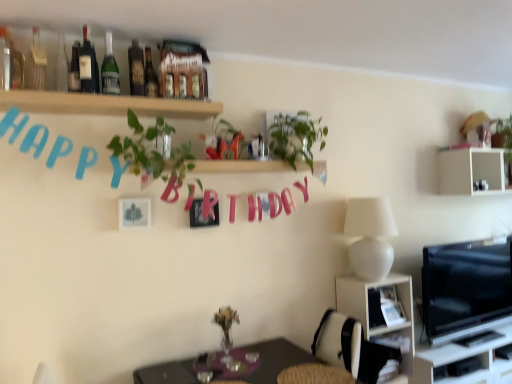
Question: Is matte black bottle at upper center, placed as the 7th bottle when sorted from left to right, situated inside green glass bottle at upper left, which appears as the 6th bottle when viewed from the left, or outside?

Choices:
 (A) outside
 (B) inside

Answer: (A)

Question: In terms of size, does matte black bottle at upper center, placed as the 7th bottle when sorted from left to right, appear bigger or smaller than green glass bottle at upper left, which appears as the 6th bottle when viewed from the left?

Choices:
 (A) small
 (B) big

Answer: (A)

Question: Which object is the farthest from the matte black bottle at upper center, placed as the 7th bottle when sorted from left to right?

Choices:
 (A) white plastic shelf at lower right, positioned as the 2th shelf in bottom-to-top order
 (B) wooden table at lower center
 (C) metallic silver picture frame at center
 (D) wooden shelf at upper center, arranged as the 4th shelf when ordered from the bottom
 (E) matte glass bottle at upper left, the 4th bottle viewed from the left

Answer: (A)

Question: Considering the real-world distances, which object is farthest from the white matte shelf at upper right, which ranks as the 4th shelf in left-to-right order?

Choices:
 (A) matte glass bottle at upper left, the 5th bottle when ordered from left to right
 (B) black glossy tv at right
 (C) wooden shelf at upper center, the 1th shelf when ordered from top to bottom
 (D) white matte table lamp at right
 (E) green leafy plant at upper center

Answer: (A)